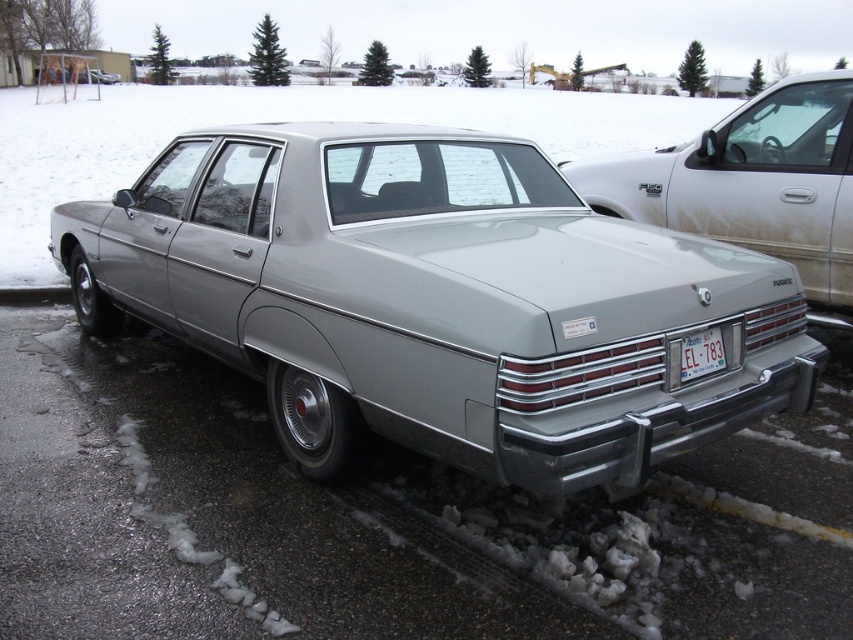
You are a photographer trying to capture the license plate of the car. You notice two cars in the image, the satin silver sedan at center and the metallic gray car at center. Which car should you focus on to read the license plate?

The satin silver sedan at center is above the metallic gray car at center, so focusing on the metallic gray car at center would allow you to read the license plate since it is positioned lower and likely closer to the camera.

You are standing at the point marked by coordinates point (438, 300). What object are you directly facing?

You are directly facing the satin silver sedan at center, as the coordinates point (438, 300) marks its location.